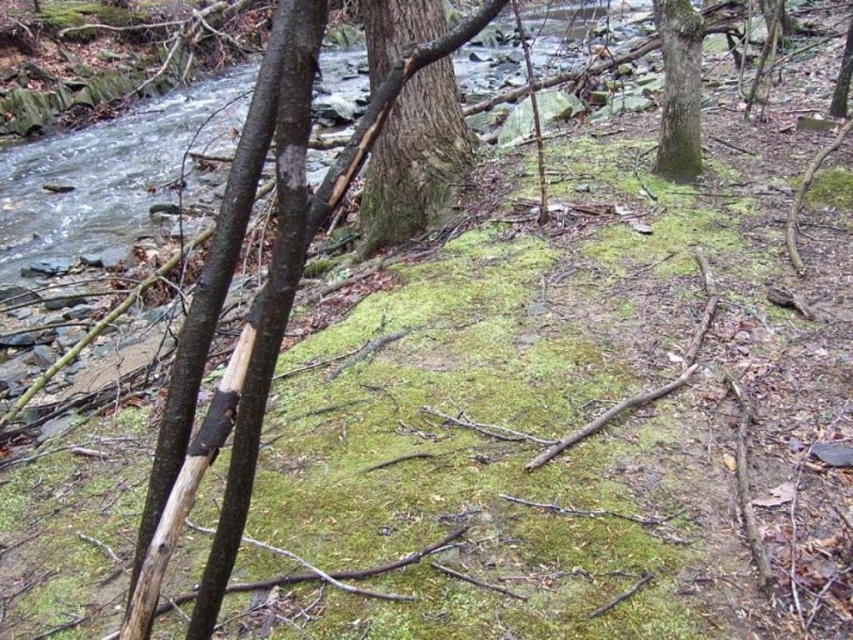
In the scene shown: Between green rough bark tree trunk at center and green rough bark tree trunk at upper right, which one is positioned higher?

green rough bark tree trunk at upper right is higher up.

Locate an element on the screen. This screenshot has height=640, width=853. green rough bark tree trunk at center is located at coordinates (415, 161).